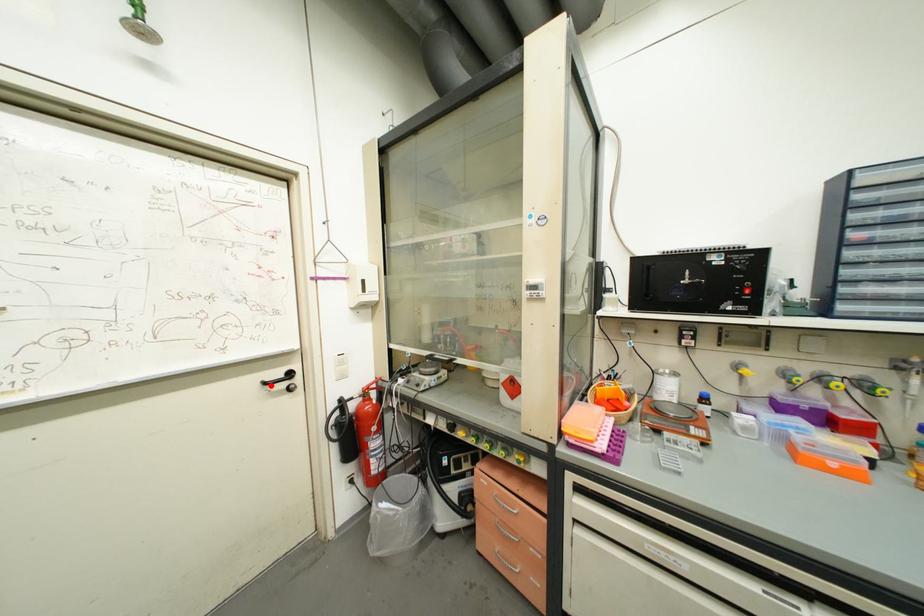
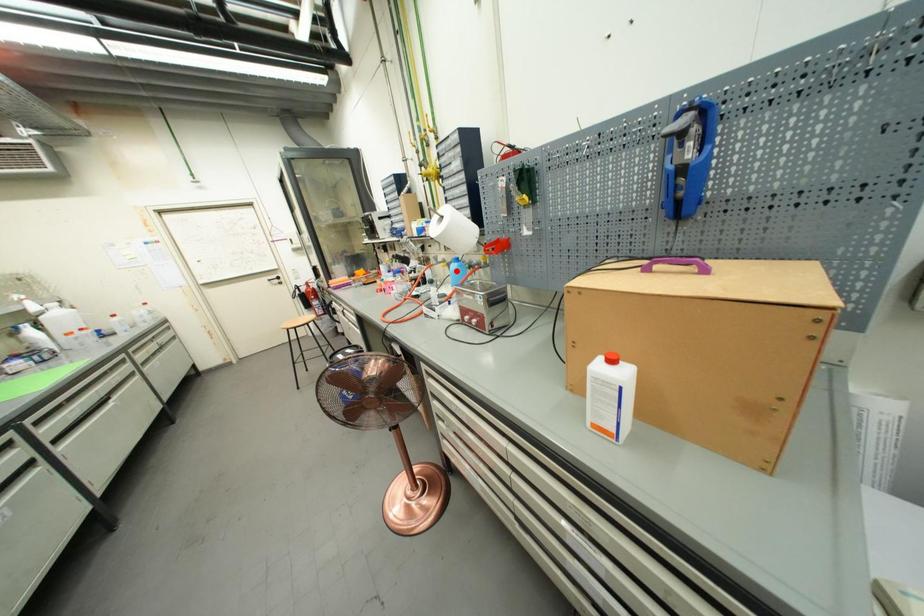
I am providing you with two images of the same scene from different viewpoints. A red point is marked on the first image and another point is marked on the second image. Is the marked point in image1 the same physical position as the marked point in image2?

No